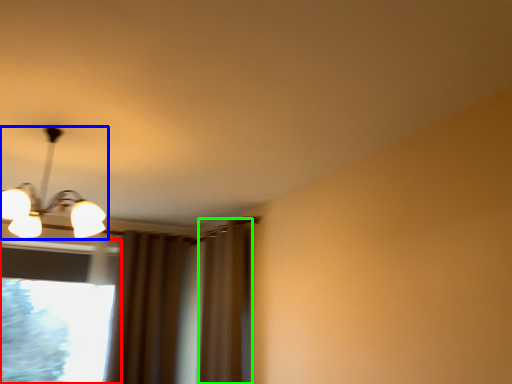
Question: Which is nearer to the window (highlighted by a red box)? lamp (highlighted by a blue box) or curtain (highlighted by a green box).

Choices:
 (A) lamp
 (B) curtain

Answer: (A)